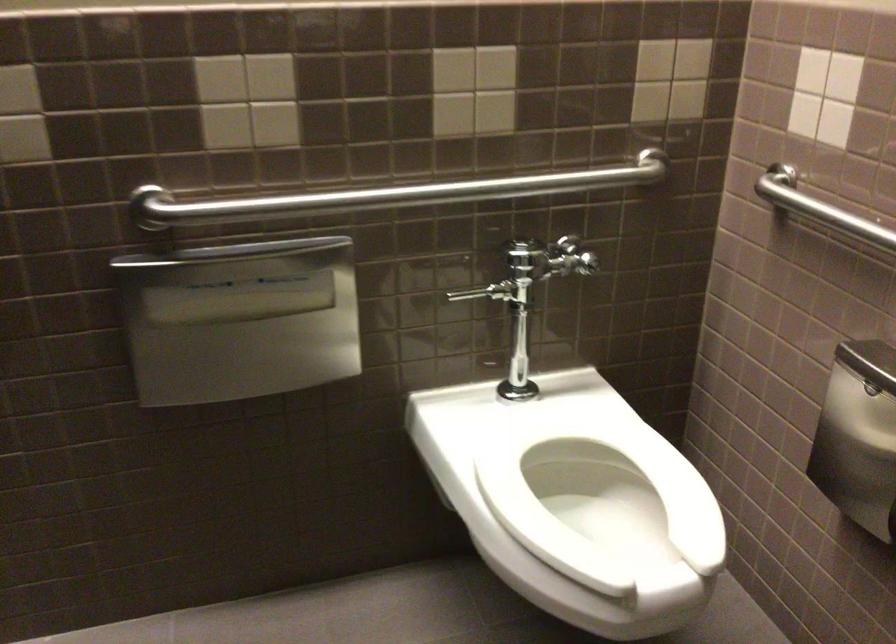
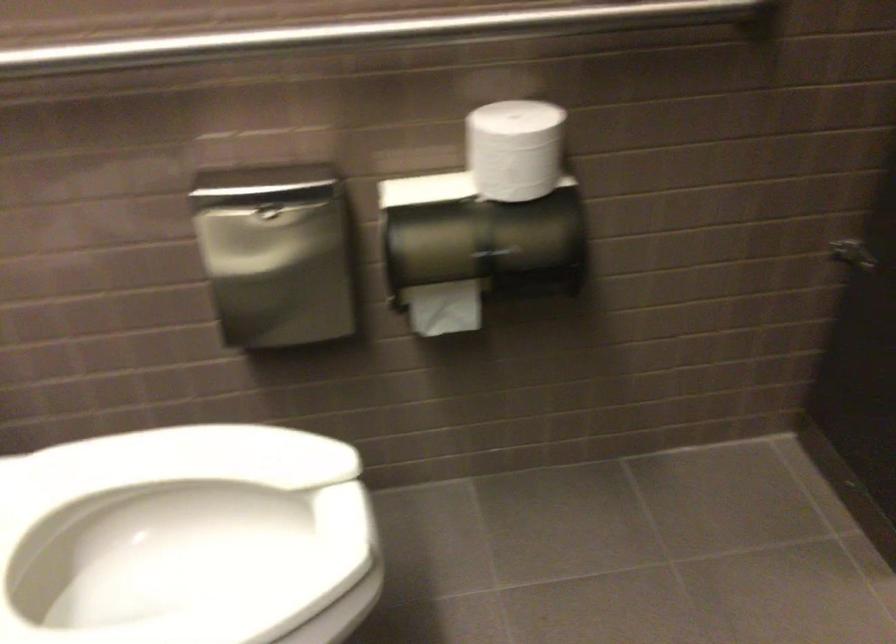
Based on the continuous images, in which direction is the camera rotating?

The rotation direction of the camera is right-down.